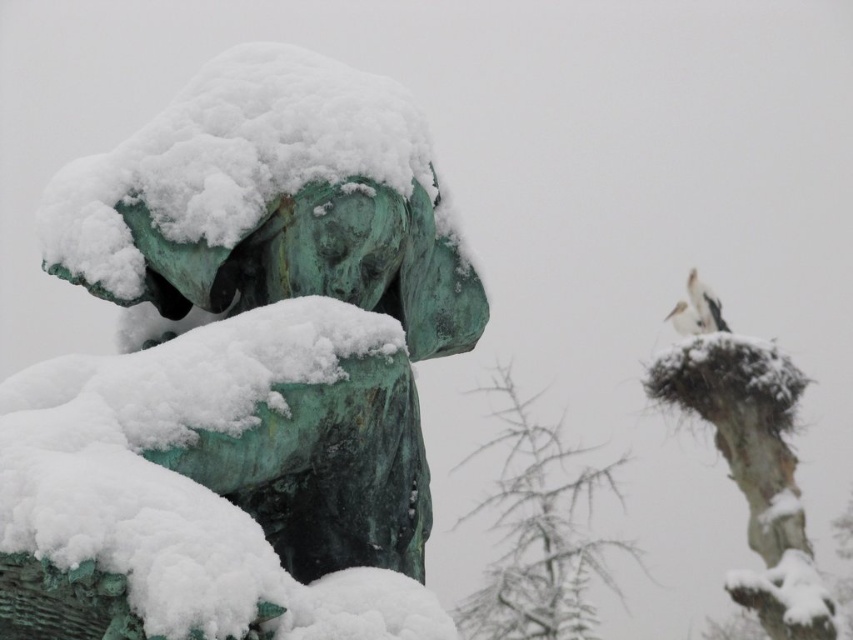
Is point (225, 376) closer to camera compared to point (680, 333)?

Yes, it is in front of point (680, 333).

Is green patina statue at center further to camera compared to white feathered bird at upper right?

No.

Locate an element on the screen. green patina statue at center is located at coordinates (239, 371).

Is green patina statue at center above white matte bird at upper right?

Yes, green patina statue at center is above white matte bird at upper right.

Who is lower down, green patina statue at center or white matte bird at upper right?

white matte bird at upper right is lower down.

What do you see at coordinates (239, 371) in the screenshot? The width and height of the screenshot is (853, 640). I see `green patina statue at center` at bounding box center [239, 371].

The height and width of the screenshot is (640, 853). In order to click on green patina statue at center in this screenshot , I will do `click(239, 371)`.

Does point (682, 326) lie in front of point (695, 321)?

That is False.

Between point (714, 301) and point (682, 304), which one is positioned in front?

Point (714, 301)

Identify the location of white matte bird at upper right. Image resolution: width=853 pixels, height=640 pixels. (697, 308).